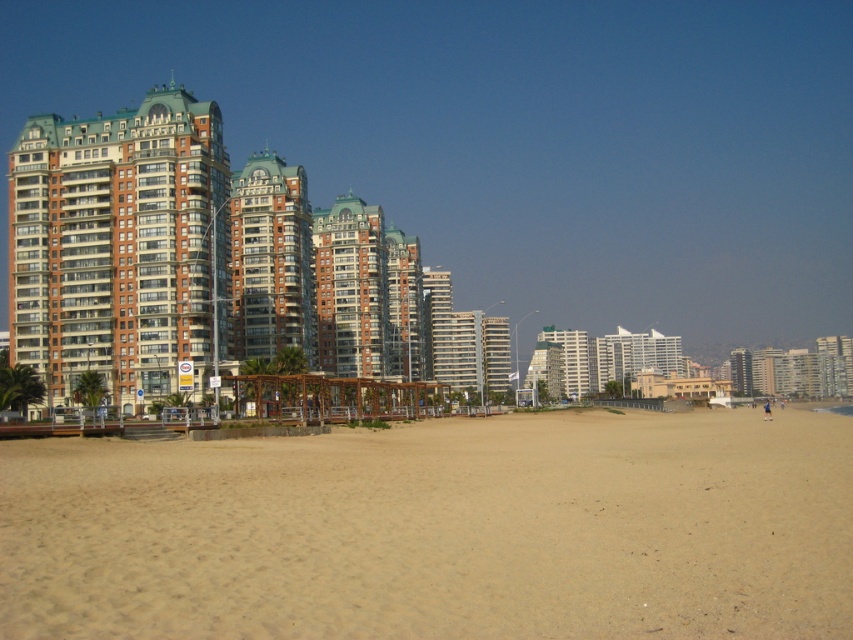
You are standing at the point marked by the coordinates point (438, 531). What is the nearest object to you in the scene?

The nearest object to you is the brown sandy beach at lower center, which is represented by the point (438, 531).

You are standing on the brown sandy beach at lower center and want to take a photo of the brown brick building at left. Can you see the building clearly from your current position?

The brown sandy beach at lower center is in front of the brown brick building at left, so you can see the building clearly from your current position.